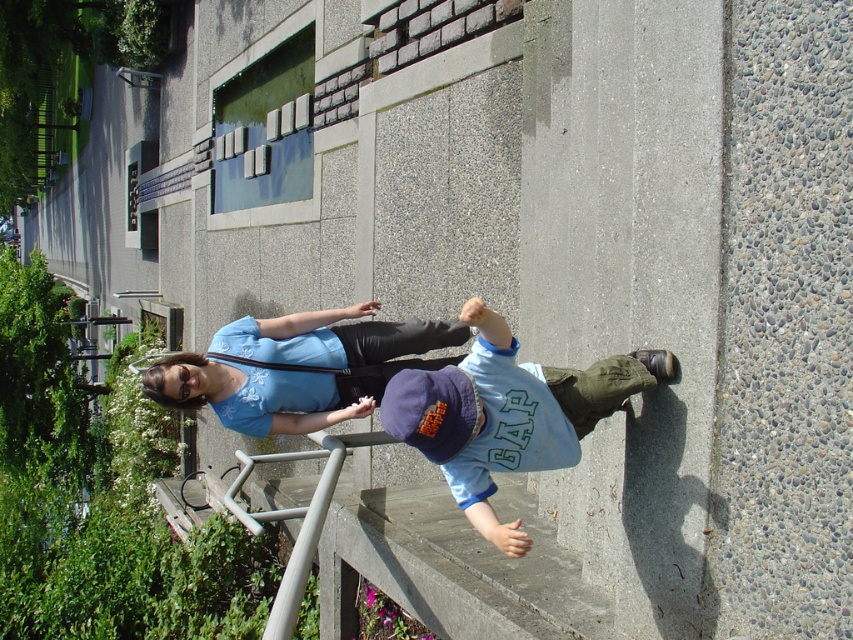
You are a photographer trying to capture a candid shot of both the blue cotton shirt at center and the matte blue shirt at center. The camera you are using has a maximum focus range of 5 feet. Can you fit both subjects into the frame without moving closer?

The blue cotton shirt at center and the matte blue shirt at center are 4.94 feet apart from each other, which is within the camera maximum focus range of 5 feet. So yes, you can fit both subjects into the frame without moving closer.

From the picture: You are a photographer at a park and see two people wearing blue shirts at center. Which one is more likely the adult? Please choose between the blue cotton shirt at center and the matte blue shirt at center.

The matte blue shirt at center is more likely the adult because the blue cotton shirt at center is smaller than matte blue shirt at center.